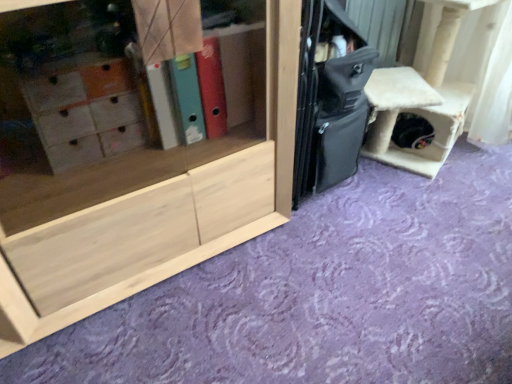
Question: From the image's perspective, would you say black matte suitcase at center is shown under natural wood cabinet at center?

Choices:
 (A) yes
 (B) no

Answer: (B)

Question: Considering the relative sizes of black matte suitcase at center and natural wood cabinet at center in the image provided, is black matte suitcase at center wider than natural wood cabinet at center?

Choices:
 (A) yes
 (B) no

Answer: (B)

Question: Is natural wood cabinet at center located within black matte suitcase at center?

Choices:
 (A) yes
 (B) no

Answer: (B)

Question: Can you confirm if black matte suitcase at center is taller than natural wood cabinet at center?

Choices:
 (A) no
 (B) yes

Answer: (A)

Question: Is black matte suitcase at center beside natural wood cabinet at center?

Choices:
 (A) yes
 (B) no

Answer: (B)

Question: From the image's perspective, is black matte suitcase at center over natural wood cabinet at center?

Choices:
 (A) yes
 (B) no

Answer: (A)

Question: Does black matte suitcase at center appear on the left side of white fluffy cat house at right?

Choices:
 (A) yes
 (B) no

Answer: (A)

Question: Is black matte suitcase at center aimed at white fluffy cat house at right?

Choices:
 (A) no
 (B) yes

Answer: (A)

Question: From the image's perspective, would you say black matte suitcase at center is positioned over white fluffy cat house at right?

Choices:
 (A) yes
 (B) no

Answer: (B)

Question: Is black matte suitcase at center looking in the opposite direction of white fluffy cat house at right?

Choices:
 (A) no
 (B) yes

Answer: (A)

Question: Is black matte suitcase at center beside white fluffy cat house at right?

Choices:
 (A) yes
 (B) no

Answer: (B)

Question: Can you confirm if black matte suitcase at center is positioned to the right of white fluffy cat house at right?

Choices:
 (A) yes
 (B) no

Answer: (B)

Question: From a real-world perspective, is white fluffy cat house at right positioned under natural wood cabinet at center based on gravity?

Choices:
 (A) no
 (B) yes

Answer: (B)